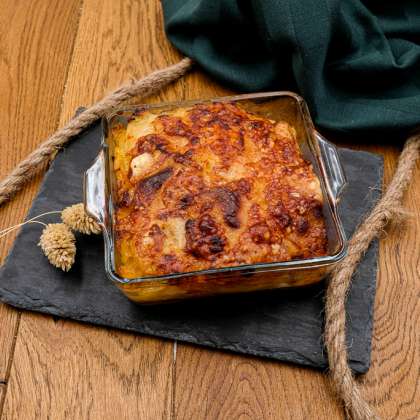
Where is `handle`? The width and height of the screenshot is (420, 420). handle is located at coordinates (339, 168), (99, 194).